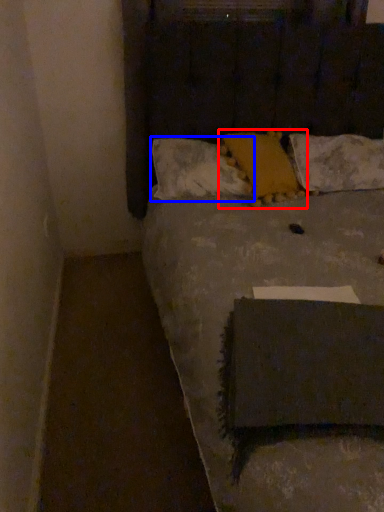
Question: Which of the following is the closest to the observer, pillow (highlighted by a red box) or pillow (highlighted by a blue box)?

Choices:
 (A) pillow
 (B) pillow

Answer: (A)